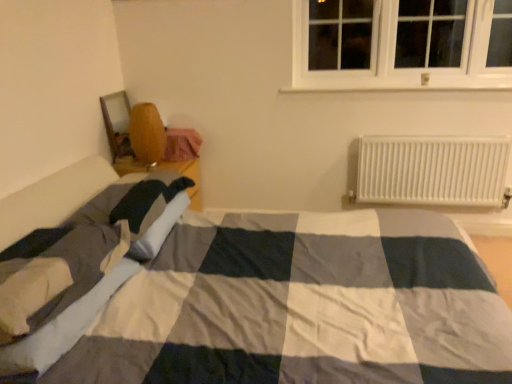
Locate an element on the screen. empty space that is ontop of white plastic radiator at right is located at coordinates (445, 132).